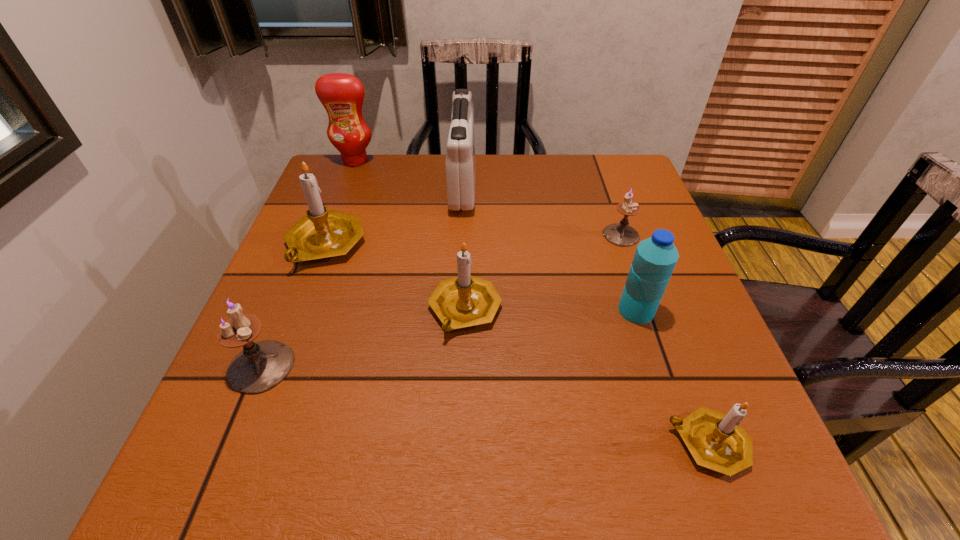
Identify the location of vacant point that satisfies the following two spatial constraints: 1. on the back side of the blue water bottle; 2. on the front side of the red first-aid kit. The height and width of the screenshot is (540, 960). (595, 185).

Locate an element on the screen. The height and width of the screenshot is (540, 960). free space that satisfies the following two spatial constraints: 1. on the front side of the nearest candle holder; 2. on the right side of the second nearest gold candle holder is located at coordinates (461, 443).

You are a GUI agent. You are given a task and a screenshot of the screen. Output one action in this format:
    pyautogui.click(x=<x>, y=<y>)
    Task: Click on the vacant space that satisfies the following two spatial constraints: 1. on the front side of the left purple candle holder; 2. on the right side of the rightmost gold candle holder
    The width and height of the screenshot is (960, 540).
    Given the screenshot: What is the action you would take?
    pyautogui.click(x=229, y=443)